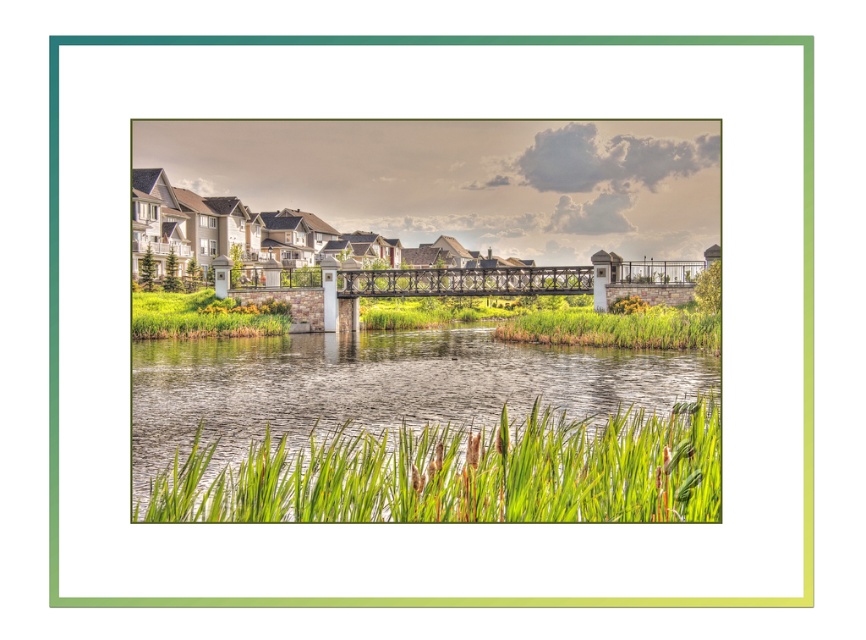
Can you confirm if green leafy grass at lower center is shorter than green grass at center?

Yes.

In order to click on green leafy grass at lower center in this screenshot , I will do `click(461, 472)`.

Does metallic bridge at center lie behind green grass at center?

Yes, metallic bridge at center is behind green grass at center.

What do you see at coordinates (459, 282) in the screenshot?
I see `metallic bridge at center` at bounding box center [459, 282].

The width and height of the screenshot is (866, 640). I want to click on metallic bridge at center, so click(459, 282).

The image size is (866, 640). In order to click on metallic bridge at center in this screenshot , I will do `click(459, 282)`.

Which is above, metallic bridge at center or green grass at lower left?

Positioned higher is metallic bridge at center.

Is metallic bridge at center taller than green grass at lower left?

Correct, metallic bridge at center is much taller as green grass at lower left.

Does point (570, 269) lie behind point (253, 317)?

No, it is not.

Image resolution: width=866 pixels, height=640 pixels. I want to click on metallic bridge at center, so click(459, 282).